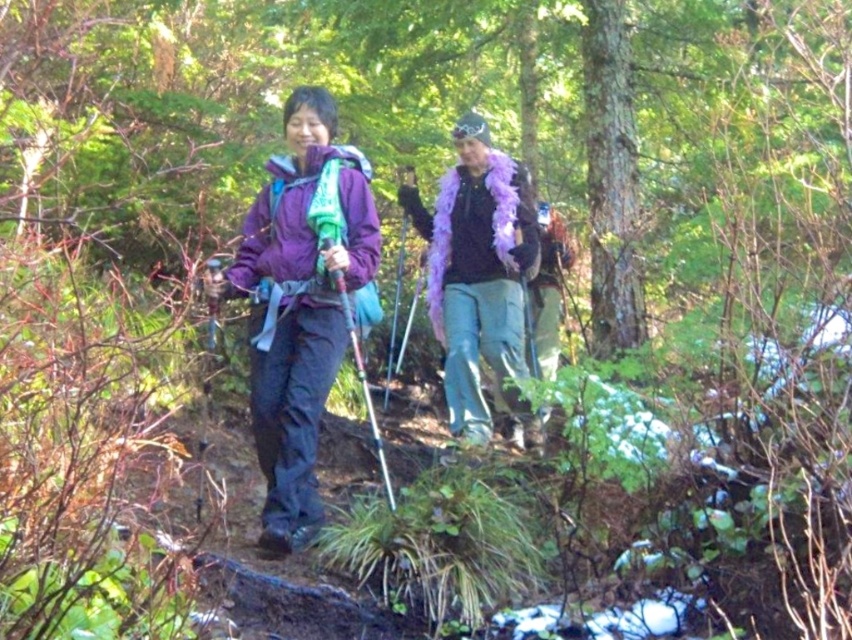
Question: Can you confirm if purple softshell jacket at center is wider than purple feather boa at center?

Choices:
 (A) no
 (B) yes

Answer: (A)

Question: Which object appears closest to the camera in this image?

Choices:
 (A) purple softshell jacket at center
 (B) purple feather boa at center

Answer: (A)

Question: Among these points, which one is farthest from the camera?

Choices:
 (A) (303, 118)
 (B) (446, 321)

Answer: (B)

Question: Is purple softshell jacket at center to the right of purple feather boa at center from the viewer's perspective?

Choices:
 (A) no
 (B) yes

Answer: (A)

Question: Observing the image, what is the correct spatial positioning of purple softshell jacket at center in reference to purple feather boa at center?

Choices:
 (A) below
 (B) above

Answer: (A)

Question: Which object is farther from the camera taking this photo?

Choices:
 (A) purple feather boa at center
 (B) purple softshell jacket at center

Answer: (A)